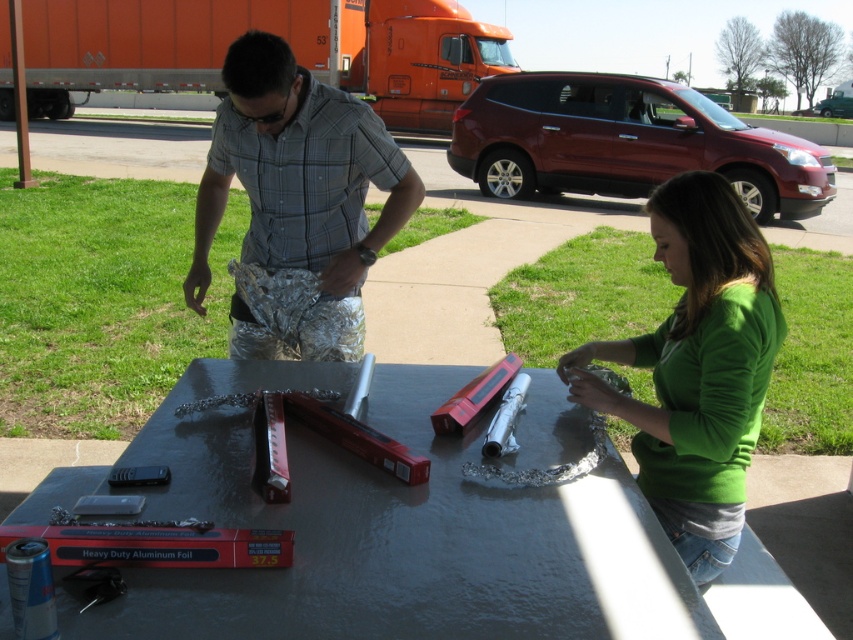
You are standing at the edge of the paved area and want to place a heavy object on the metallic gray table at center without it falling off. Considering the silver reflective foil at center is on top of the table, where should you place the object?

You should place the object on the metallic gray table at center below the silver reflective foil at center to ensure stability since the foil is on top and might not support heavy items.

You are organizing a picnic and need to place a rectangular cooler that is 1.2 meters wide. You have two options for placement in the scene described. The first option is on the metallic gray table at center, and the second option is near the orange aluminum trailer truck at upper left. Based on the table and truck dimensions, which location can accommodate the cooler without it overhanging the edge?

The metallic gray table at center is thinner than the orange aluminum trailer truck at upper left. Since the cooler is 1.2 meters wide, the orange aluminum trailer truck at upper left is wider and can accommodate the cooler without overhanging, while the table may be too narrow.